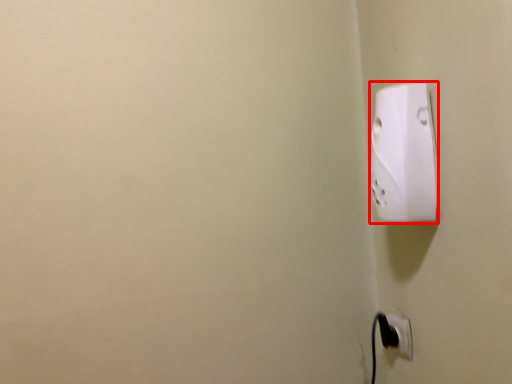
Question: From the image's perspective, where is power plugs and sockets (annotated by the red box) located relative to power plugs and sockets?

Choices:
 (A) below
 (B) above

Answer: (B)